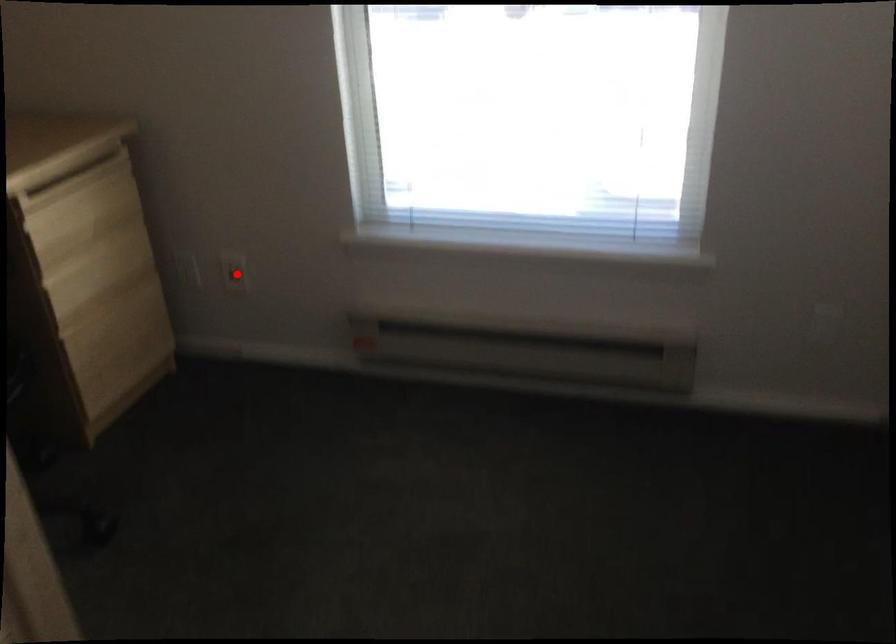
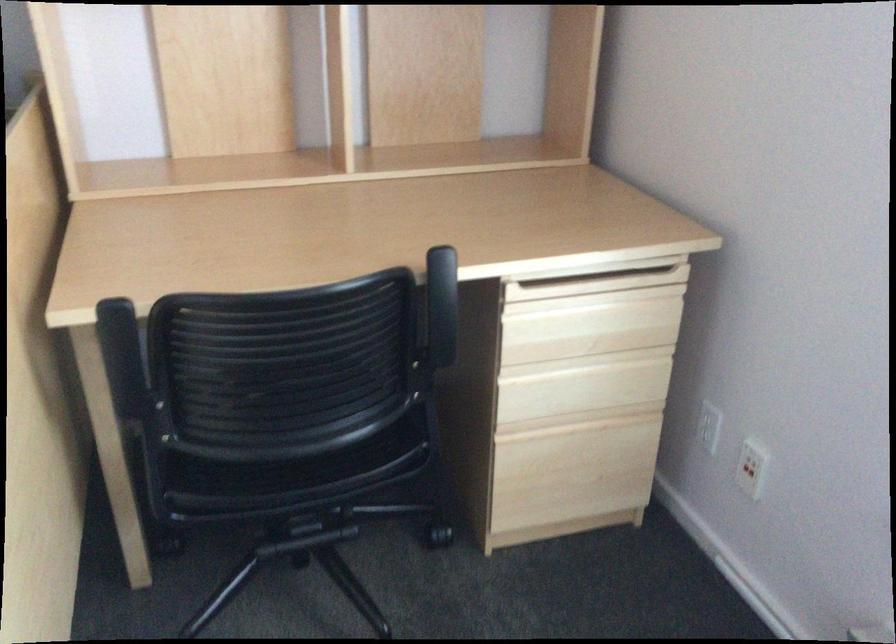
Where in the second image is the point corresponding to the highlighted location from the first image?

(747, 469)